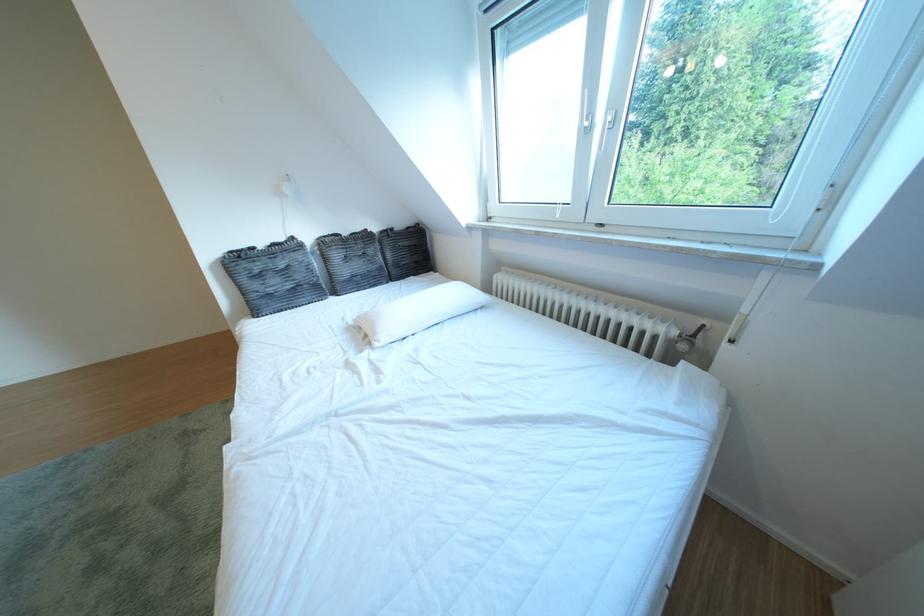
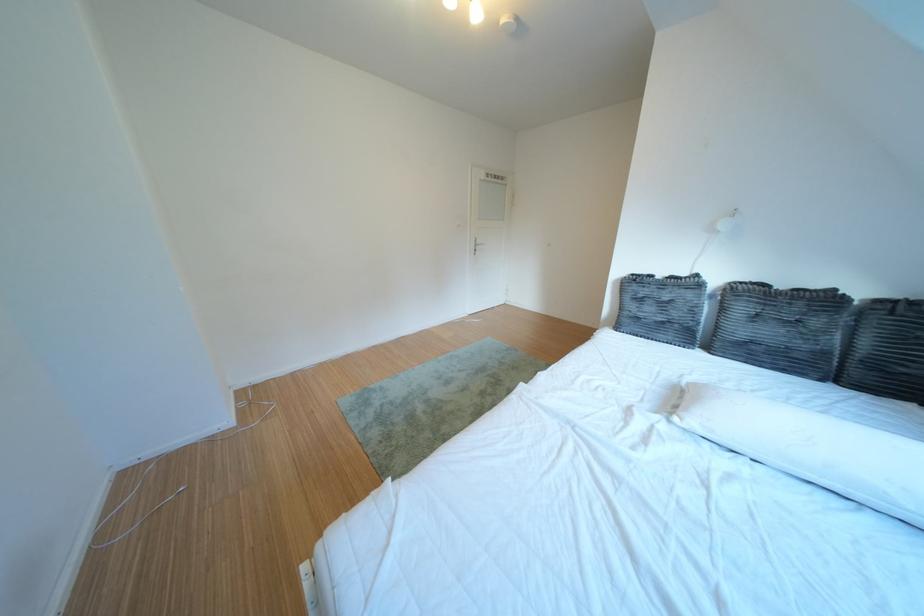
Find the pixel in the second image that matches (x=396, y=342) in the first image.

(707, 424)